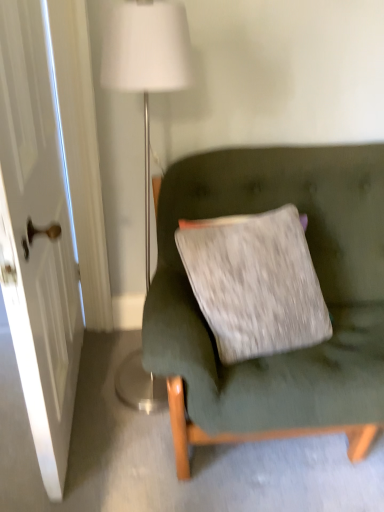
Question: Is velvet green couch at center bigger than white fabric lampshade at upper center?

Choices:
 (A) yes
 (B) no

Answer: (A)

Question: Is velvet green couch at center completely or partially outside of white fabric lampshade at upper center?

Choices:
 (A) no
 (B) yes

Answer: (B)

Question: Considering the relative sizes of velvet green couch at center and white fabric lampshade at upper center in the image provided, is velvet green couch at center thinner than white fabric lampshade at upper center?

Choices:
 (A) no
 (B) yes

Answer: (A)

Question: Considering the relative sizes of velvet green couch at center and white fabric lampshade at upper center in the image provided, is velvet green couch at center wider than white fabric lampshade at upper center?

Choices:
 (A) yes
 (B) no

Answer: (A)

Question: Is velvet green couch at center closer to the viewer compared to white fabric lampshade at upper center?

Choices:
 (A) yes
 (B) no

Answer: (B)

Question: From the image's perspective, is white glossy door at left located above or below white fabric lampshade at upper center?

Choices:
 (A) above
 (B) below

Answer: (B)

Question: Is point (49, 489) positioned closer to the camera than point (173, 50)?

Choices:
 (A) closer
 (B) farther

Answer: (B)

Question: Considering the positions of white glossy door at left and white fabric lampshade at upper center in the image, is white glossy door at left bigger or smaller than white fabric lampshade at upper center?

Choices:
 (A) small
 (B) big

Answer: (B)

Question: Is white glossy door at left wider or thinner than white fabric lampshade at upper center?

Choices:
 (A) thin
 (B) wide

Answer: (A)

Question: From the image's perspective, is white fabric lampshade at upper center above or below white glossy door at left?

Choices:
 (A) below
 (B) above

Answer: (B)

Question: Relative to white glossy door at left, is white fabric lampshade at upper center in front or behind?

Choices:
 (A) front
 (B) behind

Answer: (B)

Question: Choose the correct answer: Is white fabric lampshade at upper center inside white glossy door at left or outside it?

Choices:
 (A) outside
 (B) inside

Answer: (A)

Question: Is white fabric lampshade at upper center bigger or smaller than white glossy door at left?

Choices:
 (A) small
 (B) big

Answer: (A)

Question: From the image's perspective, is velvet green couch at center positioned above or below white glossy door at left?

Choices:
 (A) above
 (B) below

Answer: (B)

Question: From a real-world perspective, is velvet green couch at center positioned above or below white glossy door at left?

Choices:
 (A) above
 (B) below

Answer: (B)